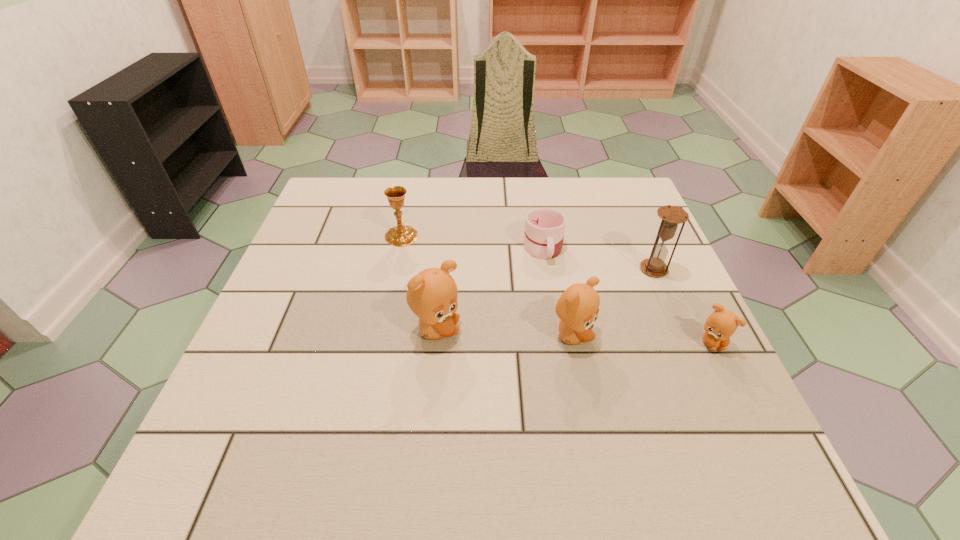
Considering the uniform spacing of teddy bears, where should an additional teddy bear be positioned on the left? Please locate a free spot. Please provide its 2D coordinates. Your answer should be formatted as a tuple, i.e. [(x, y)], where the tuple contains the x and y coordinates of a point satisfying the conditions above.

[(303, 324)]